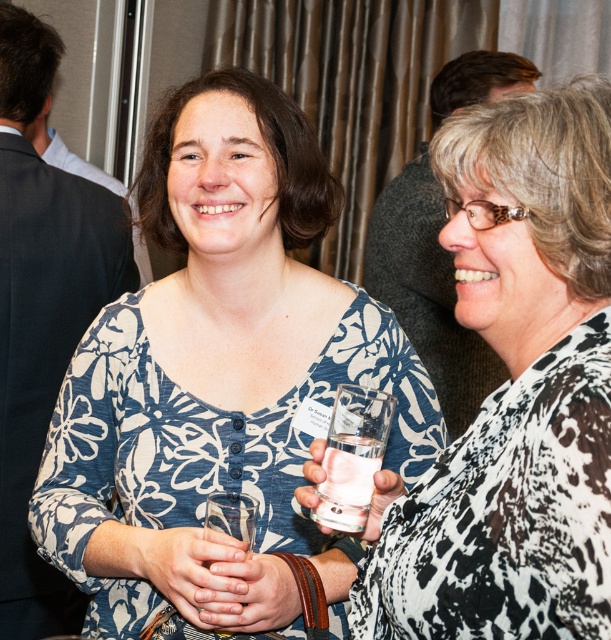
Question: Among these objects, which one is nearest to the camera?

Choices:
 (A) blue floral shirt at center
 (B) clear glass at center
 (C) white glossy glass at center

Answer: (C)

Question: Which object is closer to the camera taking this photo?

Choices:
 (A) white glossy glass at center
 (B) blue floral shirt at center
 (C) clear glass at center

Answer: (A)

Question: Can you confirm if blue floral shirt at center is positioned to the left of white glossy glass at center?

Choices:
 (A) no
 (B) yes

Answer: (B)

Question: Is white glossy glass at center to the right of clear glass at center from the viewer's perspective?

Choices:
 (A) no
 (B) yes

Answer: (B)

Question: Does blue floral shirt at center appear on the right side of clear glass at center?

Choices:
 (A) yes
 (B) no

Answer: (B)

Question: Estimate the real-world distances between objects in this image. Which object is closer to the white glossy glass at center?

Choices:
 (A) clear glass at center
 (B) blue floral shirt at center

Answer: (A)